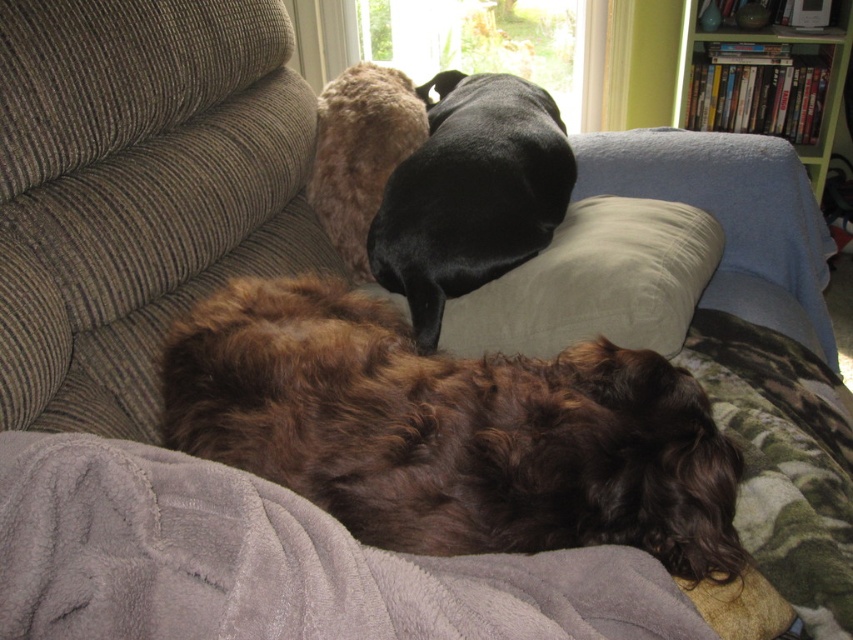
Question: Which of these objects is positioned closest to the green wood bookshelf at upper right?

Choices:
 (A) black smooth dog at center
 (B) satin beige pillow at center
 (C) brown fuzzy dog at lower center
 (D) gray fleece blanket at lower left

Answer: (A)

Question: Which object appears closest to the camera in this image?

Choices:
 (A) black smooth dog at center
 (B) green wood bookshelf at upper right
 (C) brown fuzzy dog at lower center

Answer: (C)

Question: Is black smooth dog at center positioned at the back of satin beige pillow at center?

Choices:
 (A) no
 (B) yes

Answer: (A)

Question: Can you confirm if brown fuzzy dog at lower center is positioned below gray fleece blanket at lower left?

Choices:
 (A) yes
 (B) no

Answer: (B)

Question: Does gray fleece blanket at lower left have a smaller size compared to black smooth dog at center?

Choices:
 (A) no
 (B) yes

Answer: (B)

Question: Which object is the farthest from the black smooth dog at center?

Choices:
 (A) satin beige pillow at center
 (B) brown fuzzy dog at lower center

Answer: (B)